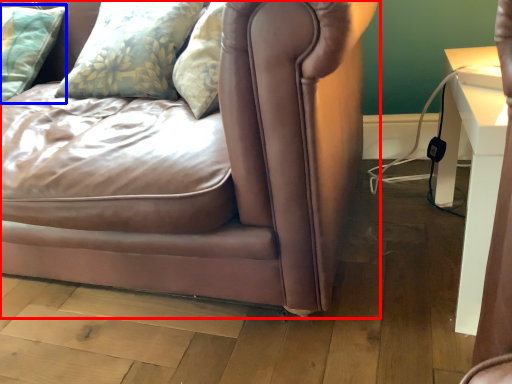
Question: Which object is further to the camera taking this photo, studio couch (highlighted by a red box) or pillow (highlighted by a blue box)?

Choices:
 (A) studio couch
 (B) pillow

Answer: (B)